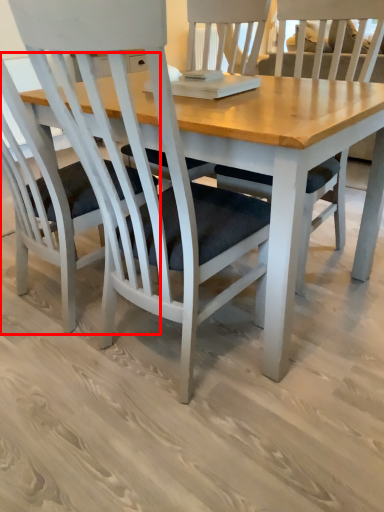
Question: Considering the relative positions of chair (annotated by the red box) and chair in the image provided, where is chair (annotated by the red box) located with respect to the staircase?

Choices:
 (A) left
 (B) right

Answer: (A)